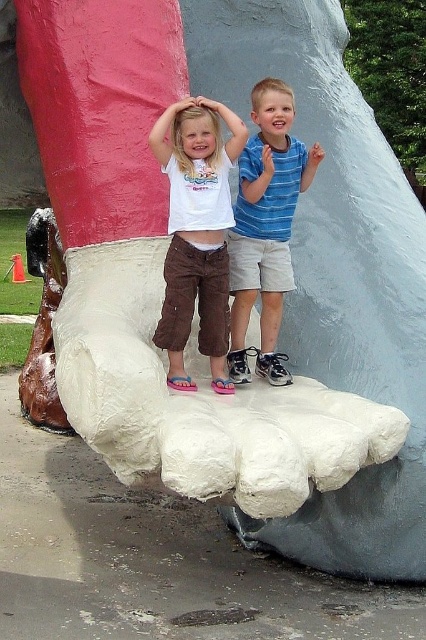
Question: Which point appears closest to the camera in this image?

Choices:
 (A) (207, 147)
 (B) (244, 211)

Answer: (A)

Question: Which object appears closest to the camera in this image?

Choices:
 (A) matte white shirt at center
 (B) blue striped shirt at center

Answer: (A)

Question: Which point is farther to the camera?

Choices:
 (A) blue striped shirt at center
 (B) matte white shirt at center

Answer: (A)

Question: Does matte white shirt at center appear over blue striped shirt at center?

Choices:
 (A) no
 (B) yes

Answer: (A)

Question: Is matte white shirt at center above blue striped shirt at center?

Choices:
 (A) no
 (B) yes

Answer: (A)

Question: Is matte white shirt at center to the right of blue striped shirt at center from the viewer's perspective?

Choices:
 (A) yes
 (B) no

Answer: (B)